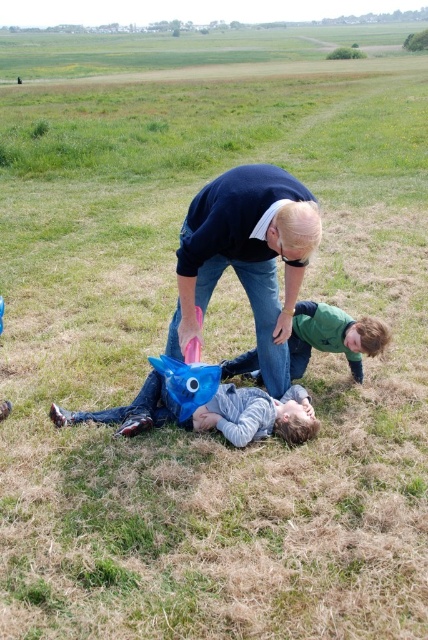
You are a delivery person who needs to place a blue fabric bag at center and a blue matte mask at center on a shelf. The shelf has a maximum length of 22 inches. Can both items fit side by side on the shelf without overlapping?

The distance between the blue fabric bag at center and blue matte mask at center is 22.96 inches, which exceeds the shelf length of 22 inches. Therefore, they cannot fit side by side without overlapping.